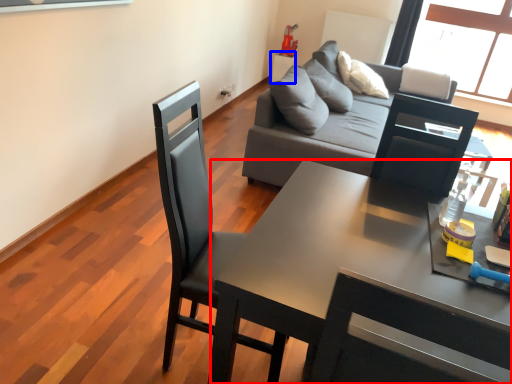
Question: Which object appears closest to the camera in this image, desk (highlighted by a red box) or side table (highlighted by a blue box)?

Choices:
 (A) desk
 (B) side table

Answer: (A)